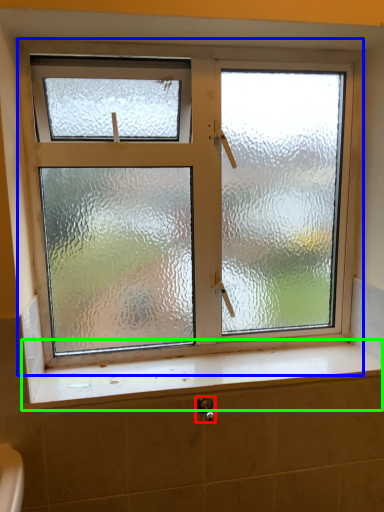
Question: Which is nearer to the shower (highlighted by a red box)? window (highlighted by a blue box) or window sill (highlighted by a green box).

Choices:
 (A) window
 (B) window sill

Answer: (B)